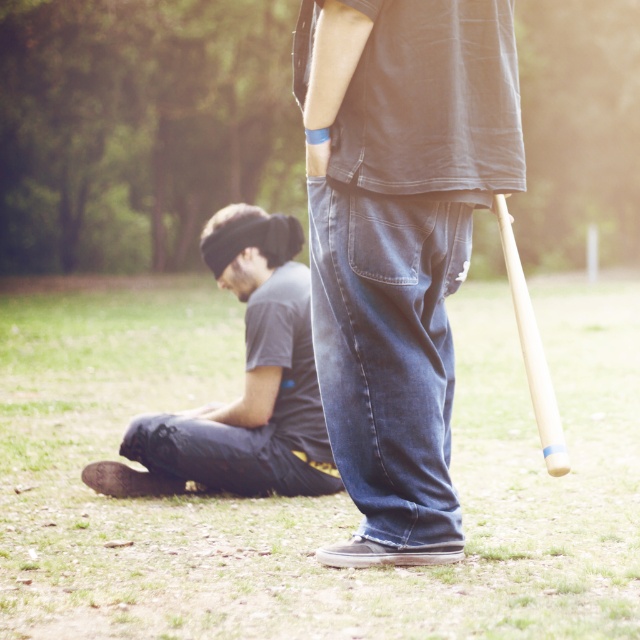
Question: Which of the following is the closest to the observer?

Choices:
 (A) green grass at lower center
 (B) wooden baseball bat at right
 (C) dark blue jeans at center

Answer: (A)

Question: Which point is closer to the camera?

Choices:
 (A) dark gray cotton shirt at lower left
 (B) dark blue jeans at center
 (C) wooden baseball bat at right
 (D) green grass at lower center

Answer: (D)

Question: Does dark blue jeans at center appear under wooden baseball bat at right?

Choices:
 (A) no
 (B) yes

Answer: (A)

Question: Which object is positioned farthest from the dark blue jeans at center?

Choices:
 (A) dark gray cotton shirt at lower left
 (B) wooden baseball bat at right

Answer: (A)

Question: Is green grass at lower center positioned at the back of wooden baseball bat at right?

Choices:
 (A) no
 (B) yes

Answer: (A)

Question: Is dark gray cotton shirt at lower left positioned at the back of wooden baseball bat at right?

Choices:
 (A) yes
 (B) no

Answer: (A)